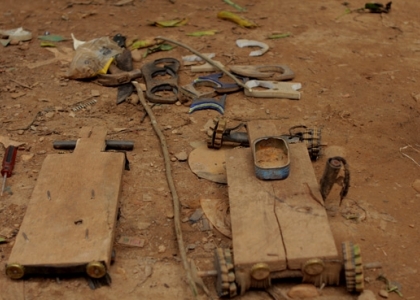
Find the location of a particular element. This screenshot has height=300, width=420. trash is located at coordinates (101, 50).